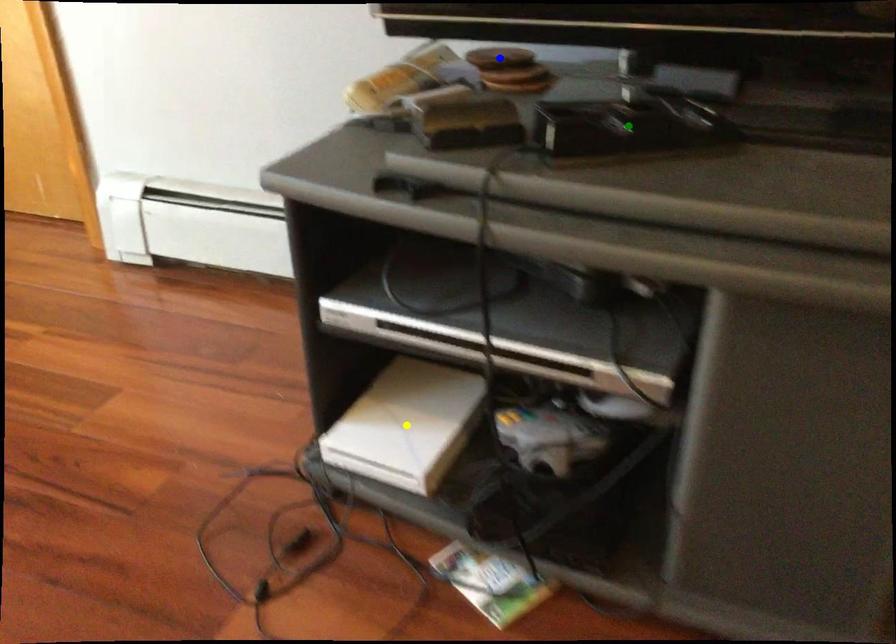
Order these from nearest to farthest:
A) green point
B) blue point
C) yellow point

1. blue point
2. yellow point
3. green point